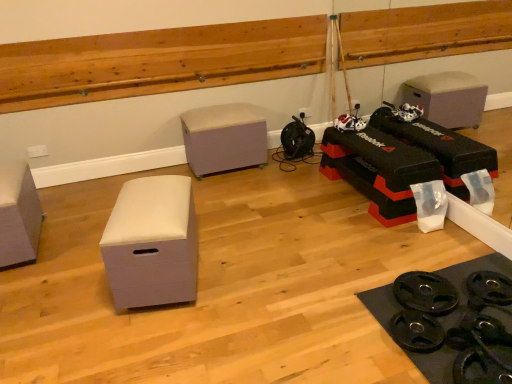
Question: Can you confirm if matte gray storage box at left, which is counted as the 2th furniture, starting from the back, is smaller than wooden ledge at upper center?

Choices:
 (A) no
 (B) yes

Answer: (B)

Question: Is wooden ledge at upper center surrounded by matte gray storage box at left, placed as the first furniture when sorted from left to right?

Choices:
 (A) yes
 (B) no

Answer: (B)

Question: Does matte gray storage box at left, placed as the third furniture when sorted from right to left, have a larger size compared to wooden ledge at upper center?

Choices:
 (A) yes
 (B) no

Answer: (B)

Question: From a real-world perspective, is matte gray storage box at left, placed as the first furniture when sorted from left to right, beneath wooden ledge at upper center?

Choices:
 (A) yes
 (B) no

Answer: (A)

Question: From the image's perspective, does matte gray storage box at left, which is counted as the 2th furniture, starting from the back, appear higher than wooden ledge at upper center?

Choices:
 (A) no
 (B) yes

Answer: (A)

Question: Would you say matte gray storage box at left, which is counted as the 2th furniture, starting from the back, is to the left or to the right of beige fabric ottoman at center, the 3th furniture positioned from the front, in the picture?

Choices:
 (A) left
 (B) right

Answer: (A)

Question: Considering the positions of matte gray storage box at left, placed as the third furniture when sorted from right to left, and beige fabric ottoman at center, which is counted as the 1th furniture, starting from the right, in the image, is matte gray storage box at left, placed as the third furniture when sorted from right to left, bigger or smaller than beige fabric ottoman at center, which is counted as the 1th furniture, starting from the right,?

Choices:
 (A) big
 (B) small

Answer: (B)

Question: Relative to beige fabric ottoman at center, the first furniture in the back-to-front sequence, is matte gray storage box at left, the second furniture when ordered from front to back, in front or behind?

Choices:
 (A) behind
 (B) front

Answer: (B)

Question: Considering the positions of matte gray storage box at left, the second furniture when ordered from front to back, and beige fabric ottoman at center, which is counted as the 1th furniture, starting from the right, in the image, is matte gray storage box at left, the second furniture when ordered from front to back, taller or shorter than beige fabric ottoman at center, which is counted as the 1th furniture, starting from the right,?

Choices:
 (A) short
 (B) tall

Answer: (A)

Question: Which is correct: beige fabric ottoman at center, the 3th furniture positioned from the front, is inside white matte storage box at center-left, which is counted as the 2th furniture, starting from the right, or outside of it?

Choices:
 (A) outside
 (B) inside

Answer: (A)

Question: Is beige fabric ottoman at center, which is counted as the 1th furniture, starting from the right, wider or thinner than white matte storage box at center-left, which is the 1th furniture from front to back?

Choices:
 (A) wide
 (B) thin

Answer: (A)

Question: Based on their sizes in the image, would you say beige fabric ottoman at center, the first furniture in the back-to-front sequence, is bigger or smaller than white matte storage box at center-left, placed as the second furniture when sorted from left to right?

Choices:
 (A) small
 (B) big

Answer: (B)

Question: Is beige fabric ottoman at center, the first furniture in the back-to-front sequence, taller or shorter than white matte storage box at center-left, placed as the second furniture when sorted from left to right?

Choices:
 (A) short
 (B) tall

Answer: (B)

Question: In the image, is white matte storage box at center-left, placed as the second furniture when sorted from left to right, positioned in front of or behind matte gray storage box at left, placed as the third furniture when sorted from right to left?

Choices:
 (A) front
 (B) behind

Answer: (A)

Question: In terms of width, does white matte storage box at center-left, which is the 1th furniture from front to back, look wider or thinner when compared to matte gray storage box at left, placed as the first furniture when sorted from left to right?

Choices:
 (A) wide
 (B) thin

Answer: (B)